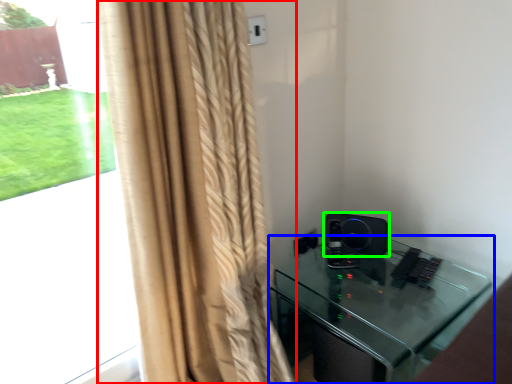
Question: Which object is positioned closest to curtain (highlighted by a red box)? Select from furniture (highlighted by a blue box) and speaker (highlighted by a green box).

Choices:
 (A) furniture
 (B) speaker

Answer: (A)